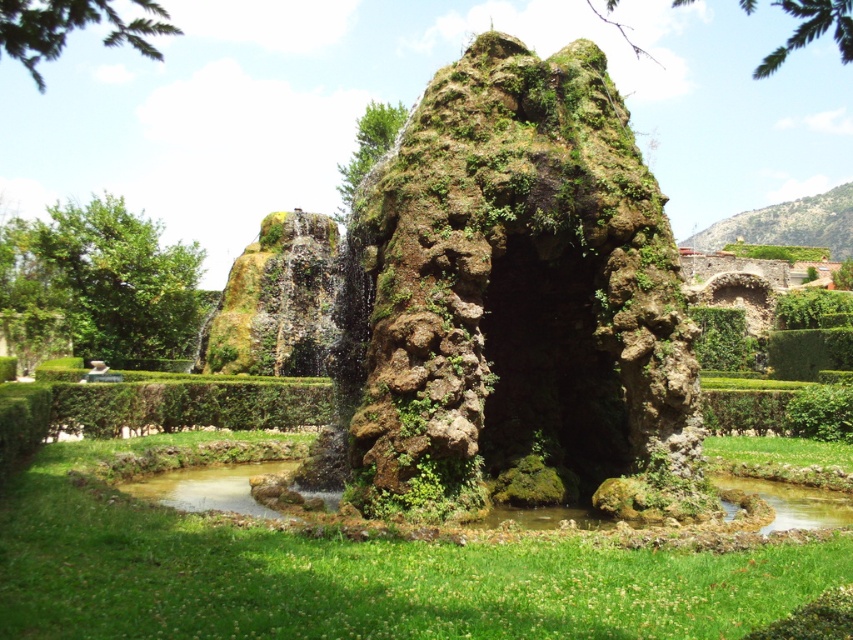
Consider the image. You are standing in the garden and see the point at coordinates (73, 28). Which object is this point located on?

The point at coordinates (73, 28) is located on the green leafy branch at upper left.

You are standing in the garden and want to place a small statue between the two points, point (527, 77) and point (373, 148). Which point should you stand closer to so that the statue is placed in front of the rock formation?

You should stand closer to point (527, 77) because it is closer to the viewer than point (373, 148). Placing the statue near this point would position it in front of the rock formation.

You are standing in the garden and want to take a photo of the green leafy hedge at center without the green leafy branch at upper left blocking it. What should you do?

Move to the right side so that the green leafy branch at upper left is no longer in front of the green leafy hedge at center.